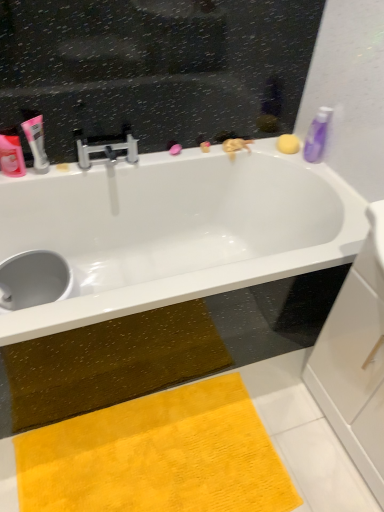
Identify the location of vacant area that is in front of purple glossy bottle at upper right, the third toiletry viewed from the left. (319, 174).